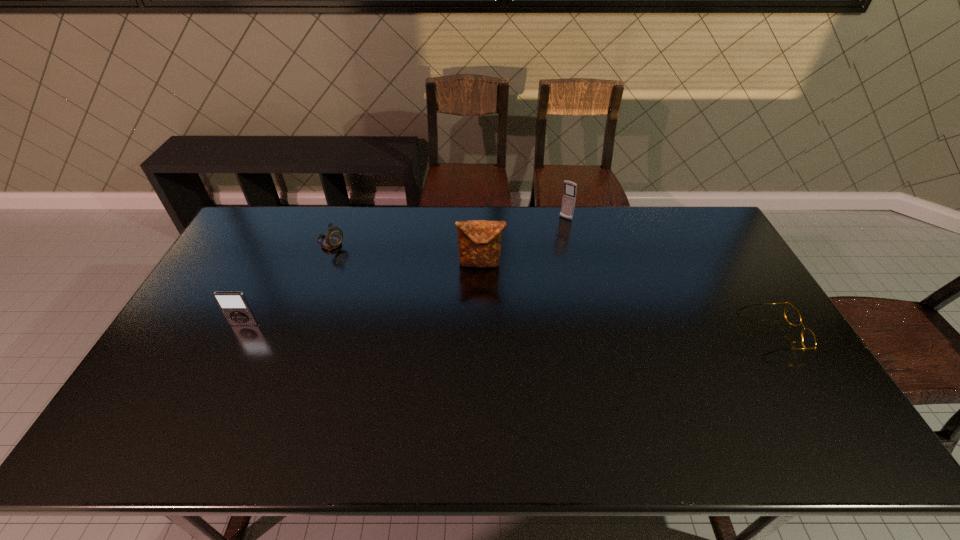
You are a GUI agent. You are given a task and a screenshot of the screen. Output one action in this format:
    pyautogui.click(x=<x>, y=<y>)
    Task: Click on the third shortest object
    
    Given the screenshot: What is the action you would take?
    pyautogui.click(x=234, y=305)

Locate an element on the screen. iPod is located at coordinates (x=234, y=305).

Where is `spectacles`? This screenshot has height=540, width=960. spectacles is located at coordinates point(791,314).

At what (x,y) coordinates should I click in order to perform the action: click on the rightmost object. Please return your answer as a coordinate pair (x, y). Looking at the image, I should click on (791, 314).

You are a GUI agent. You are given a task and a screenshot of the screen. Output one action in this format:
    pyautogui.click(x=<x>, y=<y>)
    Task: Click on the fourth object from left to right
    This screenshot has height=540, width=960.
    Given the screenshot: What is the action you would take?
    pyautogui.click(x=569, y=197)

This screenshot has height=540, width=960. I want to click on cellular telephone, so click(569, 197).

You are a GUI agent. You are given a task and a screenshot of the screen. Output one action in this format:
    pyautogui.click(x=<x>, y=<y>)
    Task: Click on the clutch bag
    The height and width of the screenshot is (540, 960).
    Given the screenshot: What is the action you would take?
    pyautogui.click(x=479, y=241)

Where is `the third object from left to right`? The image size is (960, 540). the third object from left to right is located at coordinates (479, 241).

The height and width of the screenshot is (540, 960). What are the coordinates of `the second shortest object` in the screenshot? It's located at (334, 236).

You are a GUI agent. You are given a task and a screenshot of the screen. Output one action in this format:
    pyautogui.click(x=<x>, y=<y>)
    Task: Click on the compass
    
    Given the screenshot: What is the action you would take?
    pyautogui.click(x=334, y=236)